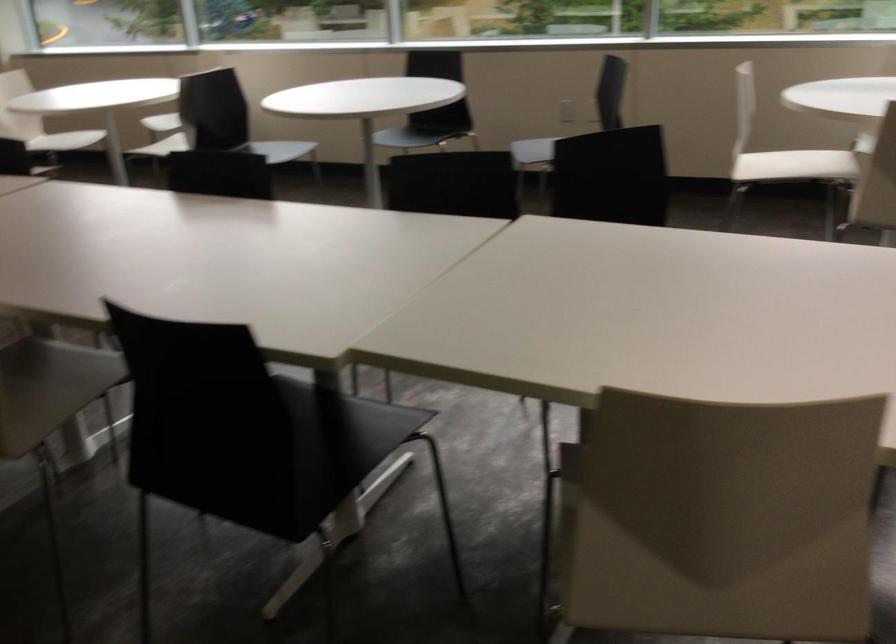
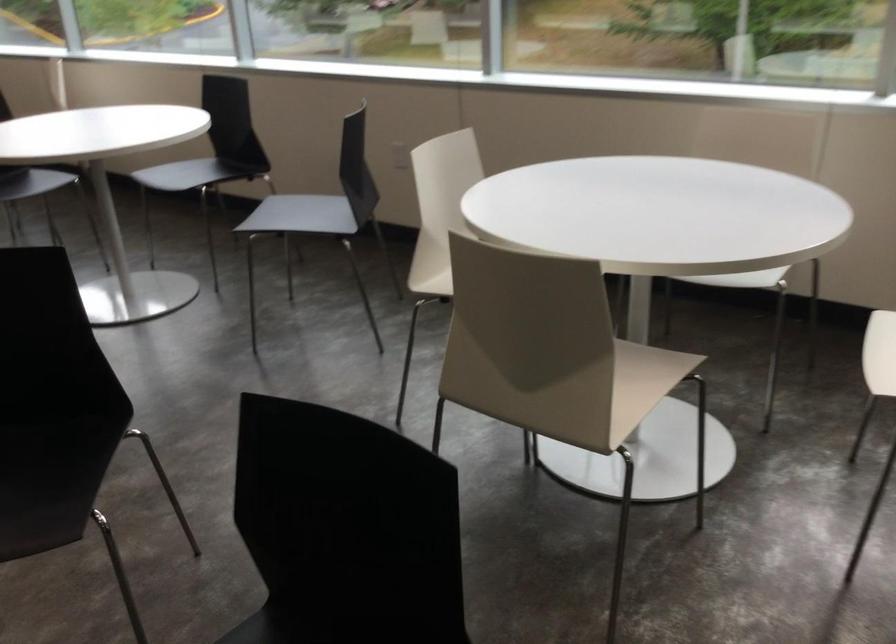
In a continuous first-person perspective shot, in which direction is the camera moving?

The cameraman walked toward right, forward.